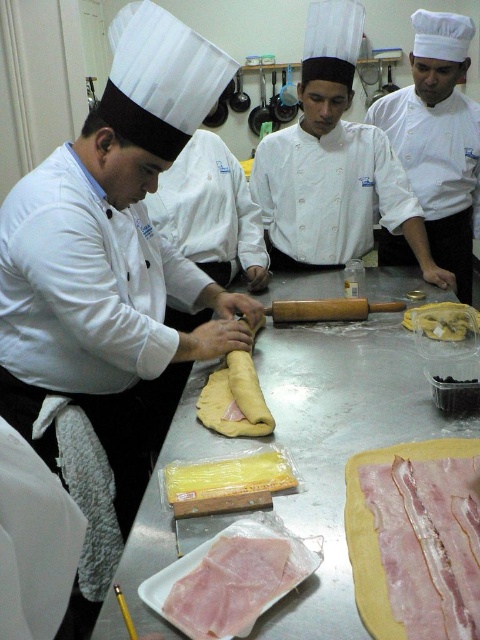
Who is lower down, pink glossy meat at center or yellow dough at center?

pink glossy meat at center is lower down.

Is pink glossy meat at center behind yellow dough at center?

No.

This screenshot has width=480, height=640. What do you see at coordinates (230, 586) in the screenshot?
I see `pink glossy meat at center` at bounding box center [230, 586].

Locate an element on the screen. This screenshot has width=480, height=640. pink glossy meat at center is located at coordinates [x=230, y=586].

Which is more to the left, white matte chef hat at upper right or yellow matte pasta at center?

yellow matte pasta at center

Does white matte chef hat at upper right have a lesser height compared to yellow matte pasta at center?

No, white matte chef hat at upper right is not shorter than yellow matte pasta at center.

Between point (415, 84) and point (214, 470), which one is positioned in front?

Point (214, 470)

Find the location of a particular element. Image resolution: width=480 pixels, height=640 pixels. white matte chef hat at upper right is located at coordinates (439, 140).

Consider the image. Who is more distant from viewer, (247, 618) or (207, 420)?

Positioned behind is point (207, 420).

Looking at this image, who is positioned more to the left, pink glossy meat at center or yellow matte dough at center?

From the viewer's perspective, yellow matte dough at center appears more on the left side.

Which is in front, point (197, 577) or point (255, 419)?

Point (197, 577) is in front.

Locate an element on the screen. The image size is (480, 640). pink glossy meat at center is located at coordinates (230, 586).